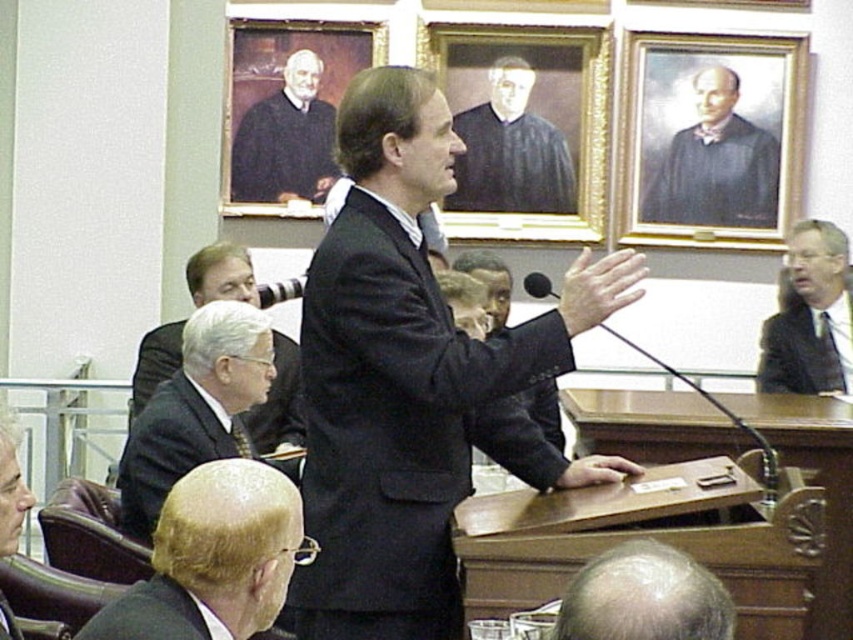
Question: Among these objects, which one is farthest from the camera?

Choices:
 (A) smooth black suit at lower left
 (B) matte black hand at center

Answer: (B)

Question: Which object is positioned closest to the matte black suit at center?

Choices:
 (A) bald head at lower left
 (B) matte black suit at lower left

Answer: (A)

Question: Does matte black suit at upper right appear on the left side of matte black robe at upper left?

Choices:
 (A) yes
 (B) no

Answer: (B)

Question: Which of the following is the closest to the observer?

Choices:
 (A) (463, 70)
 (B) (656, 618)
 (C) (555, 486)

Answer: (B)

Question: Is dark gray robe at upper right thinner than black robe at center?

Choices:
 (A) no
 (B) yes

Answer: (A)

Question: Is dark gray suit at lower left positioned at the back of matte black hand at center?

Choices:
 (A) no
 (B) yes

Answer: (B)